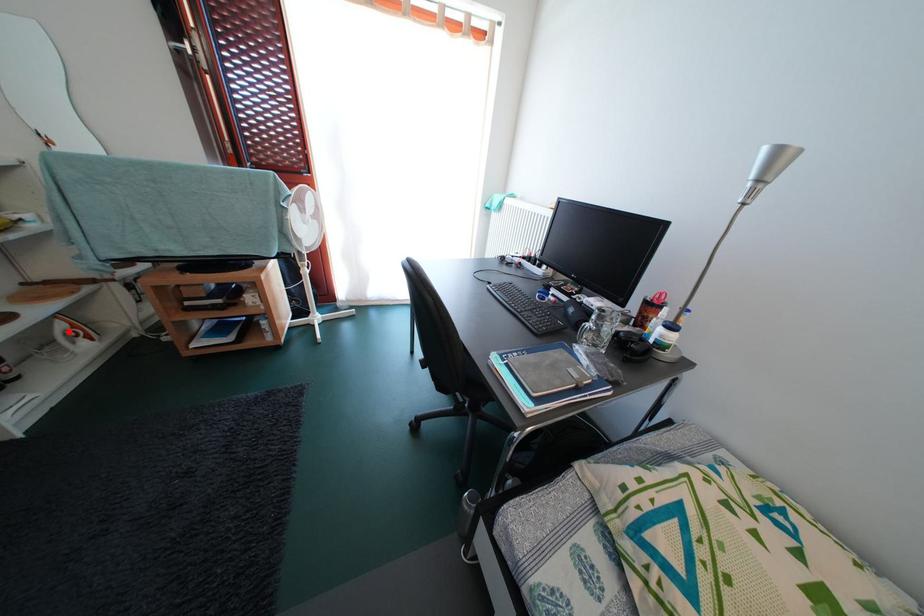
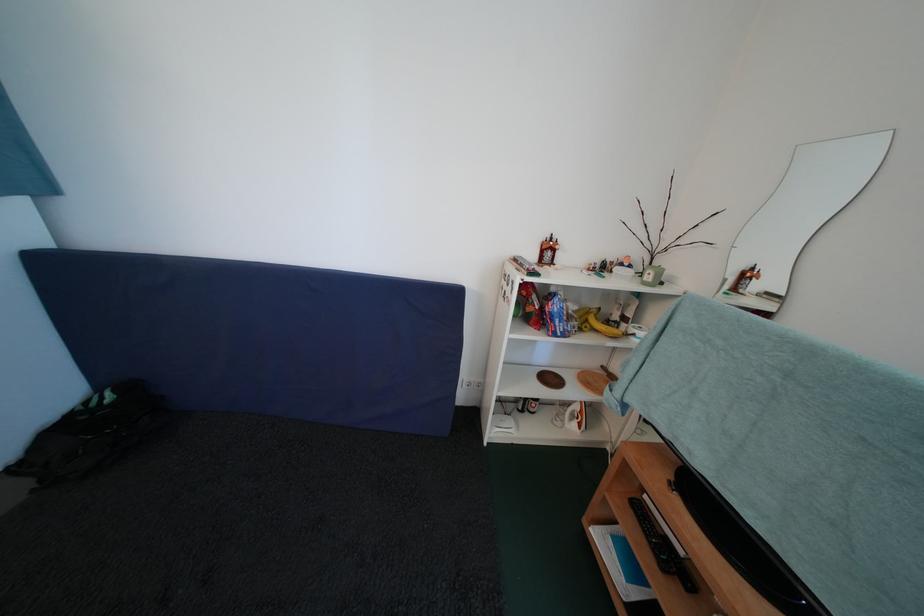
Where in the second image is the point corresponding to the highlighted location from the first image?

(584, 411)